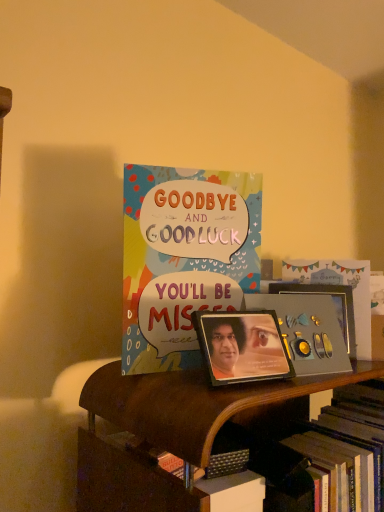
Question: From the image's perspective, does metallic gold picture frame at center, the second picture frame from the left, appear lower than multicolored paper card at center?

Choices:
 (A) no
 (B) yes

Answer: (B)

Question: From the image's perspective, does metallic gold picture frame at center, the 2th picture frame viewed from the front, appear higher than multicolored paper card at center?

Choices:
 (A) yes
 (B) no

Answer: (B)

Question: Considering the relative sizes of metallic gold picture frame at center, the second picture frame from the left, and multicolored paper card at center in the image provided, is metallic gold picture frame at center, the second picture frame from the left, bigger than multicolored paper card at center?

Choices:
 (A) yes
 (B) no

Answer: (B)

Question: Does metallic gold picture frame at center, which ranks as the 1th picture frame in right-to-left order, touch multicolored paper card at center?

Choices:
 (A) yes
 (B) no

Answer: (B)

Question: Is metallic gold picture frame at center, the second picture frame from the left, positioned before multicolored paper card at center?

Choices:
 (A) yes
 (B) no

Answer: (B)

Question: From a real-world perspective, is metallic photo frame at center, arranged as the 2th picture frame when viewed from the back, above or below multicolored paper card at center?

Choices:
 (A) below
 (B) above

Answer: (A)

Question: Considering the positions of metallic photo frame at center, the first picture frame positioned from the front, and multicolored paper card at center in the image, is metallic photo frame at center, the first picture frame positioned from the front, bigger or smaller than multicolored paper card at center?

Choices:
 (A) small
 (B) big

Answer: (A)

Question: From the image's perspective, is metallic photo frame at center, the first picture frame positioned from the left, above or below multicolored paper card at center?

Choices:
 (A) below
 (B) above

Answer: (A)

Question: Is point (216, 328) closer or farther from the camera than point (193, 345)?

Choices:
 (A) farther
 (B) closer

Answer: (B)

Question: In the image, is wooden bookshelf at lower center on the left side or the right side of metallic photo frame at center, the 2th picture frame in the right-to-left sequence?

Choices:
 (A) left
 (B) right

Answer: (B)

Question: Is wooden bookshelf at lower center bigger or smaller than metallic photo frame at center, the first picture frame positioned from the front?

Choices:
 (A) big
 (B) small

Answer: (A)

Question: Does point (142, 418) appear closer or farther from the camera than point (251, 380)?

Choices:
 (A) farther
 (B) closer

Answer: (B)

Question: Is wooden bookshelf at lower center inside the boundaries of metallic photo frame at center, the first picture frame positioned from the front, or outside?

Choices:
 (A) inside
 (B) outside

Answer: (B)

Question: From the image's perspective, is multicolored paper card at center above or below metallic gold picture frame at center, which ranks as the 1th picture frame in right-to-left order?

Choices:
 (A) below
 (B) above

Answer: (B)

Question: Considering their positions, is multicolored paper card at center located in front of or behind metallic gold picture frame at center, the 2th picture frame viewed from the front?

Choices:
 (A) front
 (B) behind

Answer: (A)